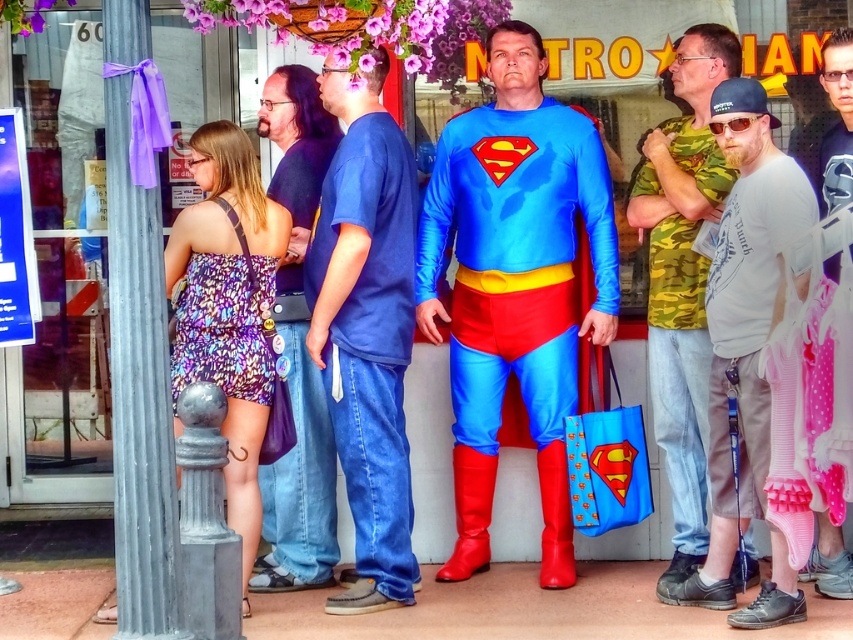
You are a photographer trying to capture a clear shot of both the blue denim jeans at center and the printed fabric dress at center. Since the camera can only focus on one object at a time, which object should you choose to ensure the details are clearer?

The blue denim jeans at center is thinner than the printed fabric dress at center, so choosing the blue denim jeans at center would allow for clearer details due to its narrower width.